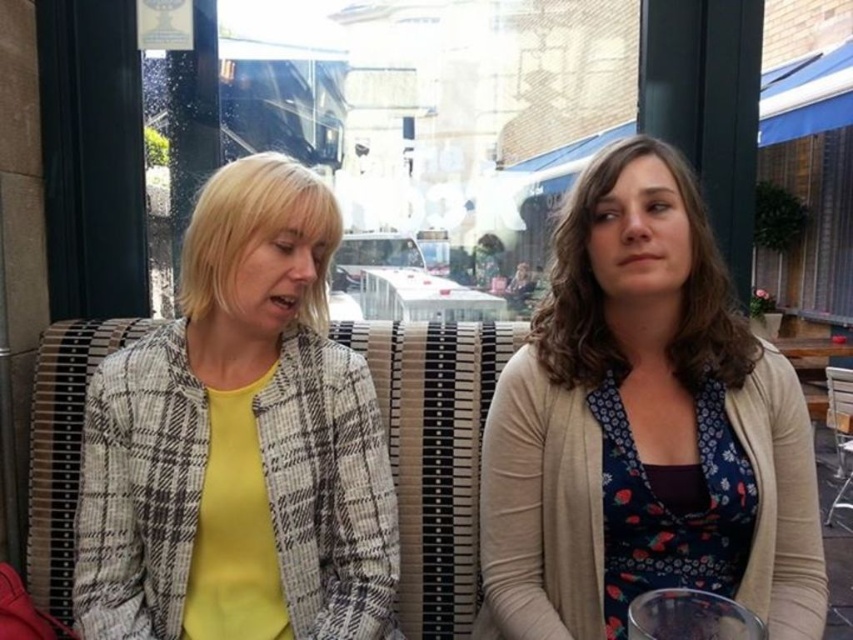
Question: Can you confirm if plaid fabric jacket at left is positioned below white plastic table at center?

Choices:
 (A) no
 (B) yes

Answer: (B)

Question: Which point is farther from the camera taking this photo?

Choices:
 (A) (422, 273)
 (B) (648, 268)
 (C) (248, 417)

Answer: (A)

Question: Which object is positioned closest to the plaid fabric jacket at left?

Choices:
 (A) white plastic table at center
 (B) floral print blouse at center

Answer: (B)

Question: Is plaid fabric jacket at left thinner than white plastic table at center?

Choices:
 (A) yes
 (B) no

Answer: (B)

Question: Is floral print blouse at center closer to camera compared to plaid fabric jacket at left?

Choices:
 (A) no
 (B) yes

Answer: (B)

Question: Which of the following is the closest to the observer?

Choices:
 (A) white plastic table at center
 (B) floral print blouse at center
 (C) plaid fabric jacket at left

Answer: (B)